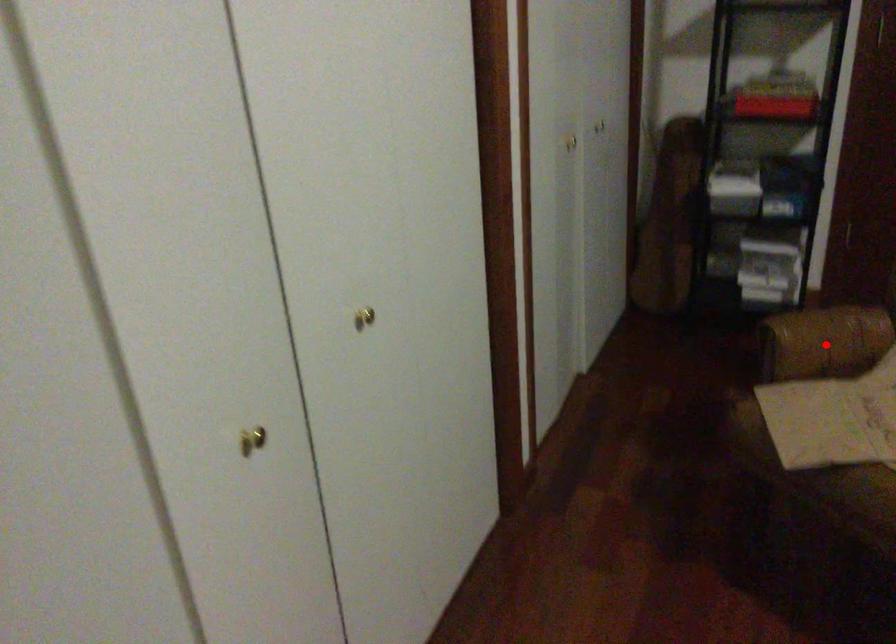
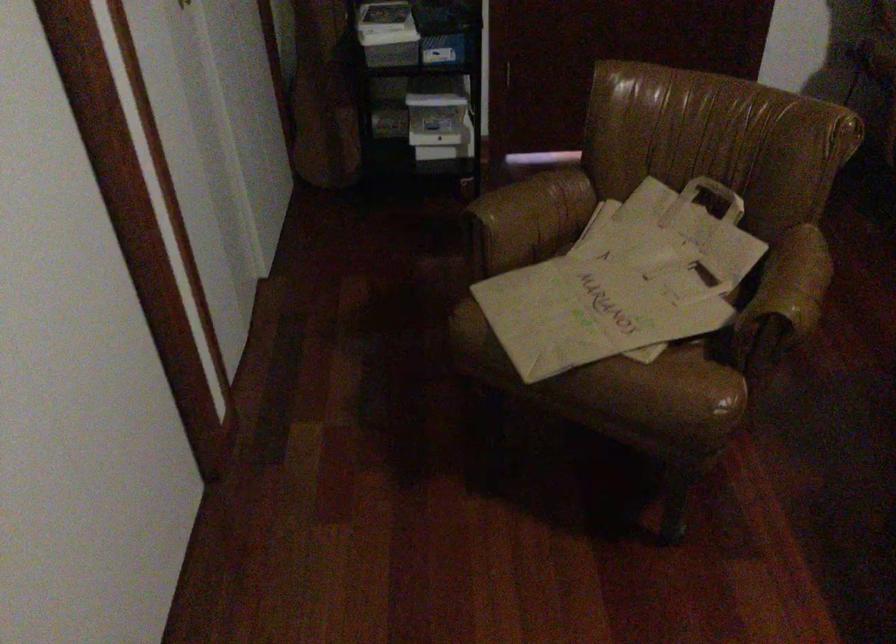
Question: I am providing you with two images of the same scene from different viewpoints. A red point is shown in image1. For the corresponding object point in image2, is it positioned nearer or farther from the camera?

Choices:
 (A) Nearer
 (B) Farther

Answer: (A)